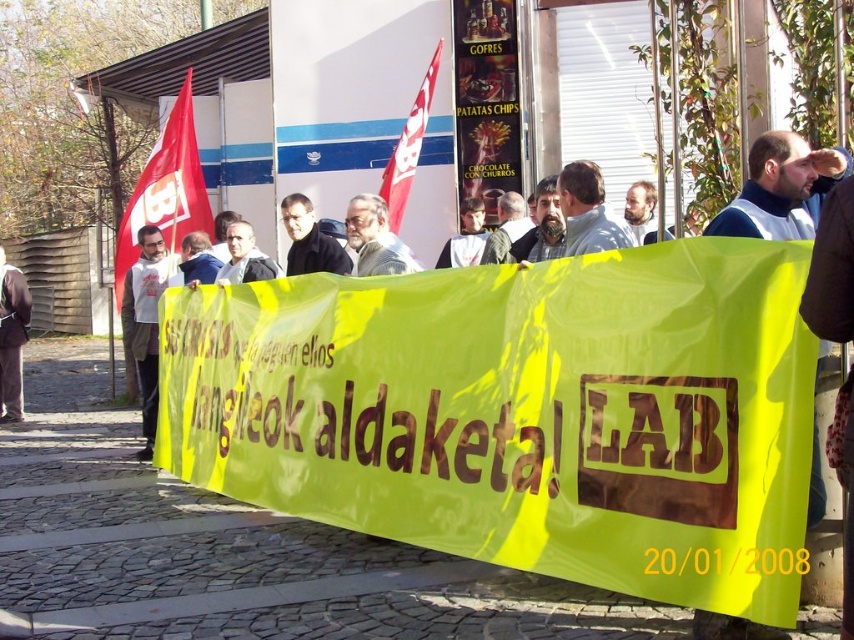
What is the 2D coordinate of the white fleece jacket at left?

The 2D coordinate of the white fleece jacket at left is at point (145, 323).

You are a photographer trying to capture the protest scene. You notice the brown leather jacket at lower left and the red fabric flag at upper center. Which object should you focus on to ensure it appears larger in your photo?

The red fabric flag at upper center should be focused on to appear larger because it has a greater height compared to the brown leather jacket at lower left.